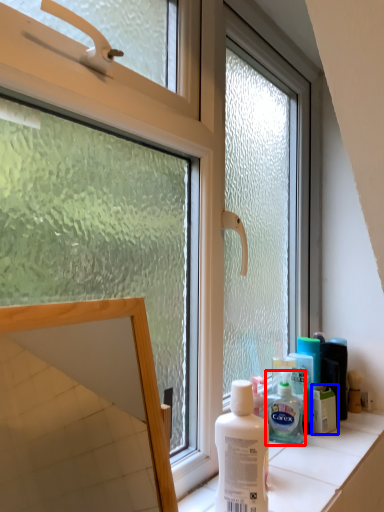
Question: Among these objects, which one is farthest to the camera, shaving cream (highlighted by a red box) or product (highlighted by a blue box)?

Choices:
 (A) shaving cream
 (B) product

Answer: (B)